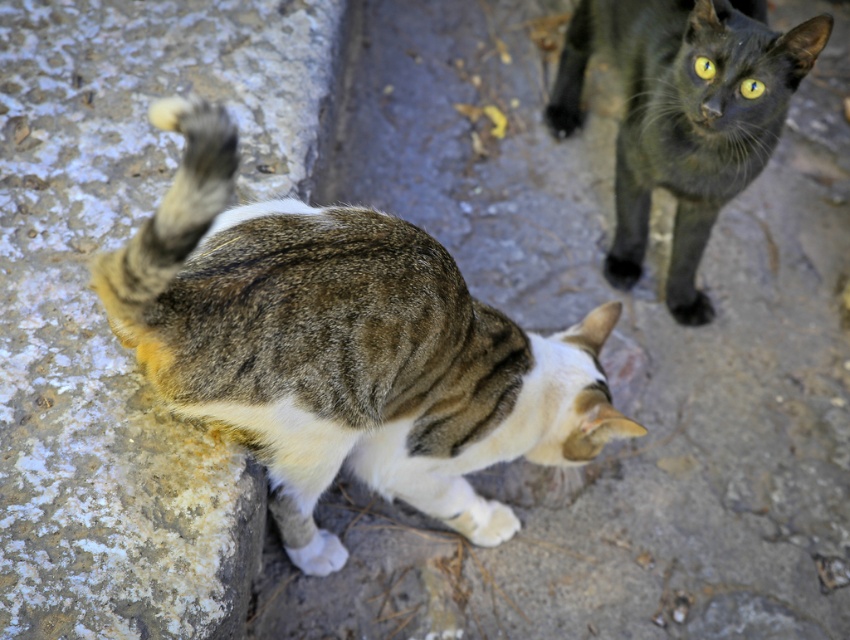
Consider the image. Between rusty concrete stone at lower left and tabby fur cat at lower left, which one has more height?

rusty concrete stone at lower left

Who is lower down, rusty concrete stone at lower left or tabby fur cat at lower left?

Positioned lower is tabby fur cat at lower left.

Where is `rusty concrete stone at lower left`? This screenshot has width=850, height=640. rusty concrete stone at lower left is located at coordinates (103, 314).

Identify the location of rusty concrete stone at lower left. point(103,314).

Can you confirm if rusty concrete stone at lower left is taller than shiny black cat at upper right?

Indeed, rusty concrete stone at lower left has a greater height compared to shiny black cat at upper right.

Is rusty concrete stone at lower left shorter than shiny black cat at upper right?

No.

At what (x,y) coordinates should I click in order to perform the action: click on rusty concrete stone at lower left. Please return your answer as a coordinate pair (x, y). The image size is (850, 640). Looking at the image, I should click on (103, 314).

Locate an element on the screen. This screenshot has width=850, height=640. rusty concrete stone at lower left is located at coordinates (103, 314).

Which of these two, tabby fur cat at lower left or shiny black cat at upper right, stands taller?

With more height is shiny black cat at upper right.

Can you confirm if tabby fur cat at lower left is shorter than shiny black cat at upper right?

Yes.

In order to click on tabby fur cat at lower left in this screenshot , I will do `click(343, 348)`.